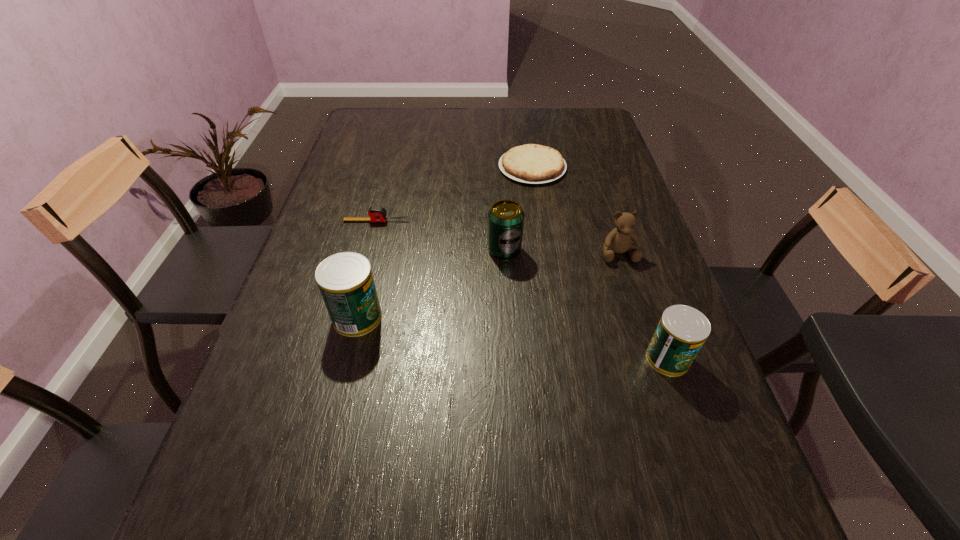
If we want them evenly spaced by inserting an extra can among them, please locate a free spot for this new can. Please provide its 2D coordinates. Your answer should be formatted as a tuple, i.e. [(x, y)], where the tuple contains the x and y coordinates of a point satisfying the conditions above.

[(506, 337)]